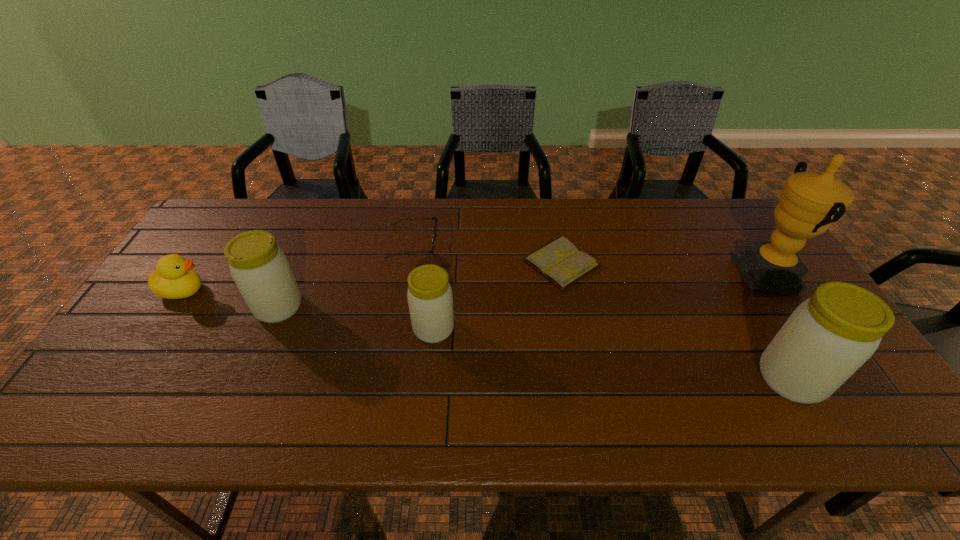
Find the location of `the second object from left to right`. the second object from left to right is located at coordinates (260, 269).

Where is `the leftmost jar`? The image size is (960, 540). the leftmost jar is located at coordinates (260, 269).

Identify the location of the shortest jar. (430, 299).

This screenshot has height=540, width=960. I want to click on the second jar from left to right, so click(x=430, y=299).

I want to click on the nearest jar, so click(x=828, y=337).

Find the location of a particular element. Image resolution: width=960 pixels, height=540 pixels. the nearest object is located at coordinates (828, 337).

Where is `the second shortest object`? This screenshot has height=540, width=960. the second shortest object is located at coordinates (435, 226).

Identify the location of award. (810, 202).

Find the location of a particular element. the fifth object from left to right is located at coordinates (560, 262).

This screenshot has width=960, height=540. Find the location of `diary`. diary is located at coordinates (560, 262).